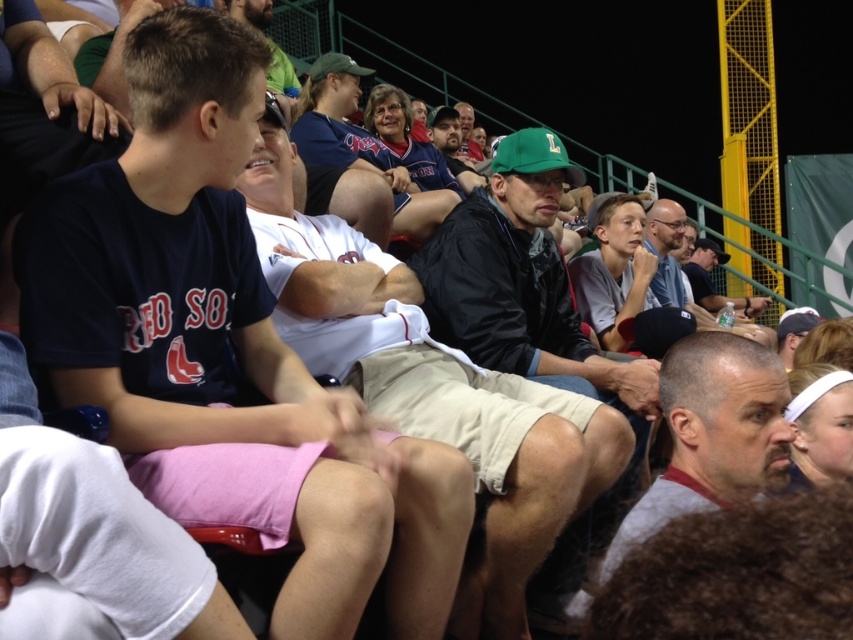
Question: Can you confirm if dark blue jersey at center is wider than gray t-shirt at center?

Choices:
 (A) no
 (B) yes

Answer: (B)

Question: Which object is the farthest from the khaki shorts at center?

Choices:
 (A) gray t-shirt at center
 (B) green fabric cap at center

Answer: (B)

Question: Which point is closer to the camera?

Choices:
 (A) (345, 76)
 (B) (218, 93)

Answer: (B)

Question: Which of the following is the farthest from the observer?

Choices:
 (A) green fabric cap at center
 (B) gray t-shirt at center

Answer: (A)

Question: Does dark blue jersey at center lie in front of khaki shorts at center?

Choices:
 (A) yes
 (B) no

Answer: (A)

Question: Does khaki shorts at center appear on the right side of gray t-shirt at center?

Choices:
 (A) no
 (B) yes

Answer: (A)